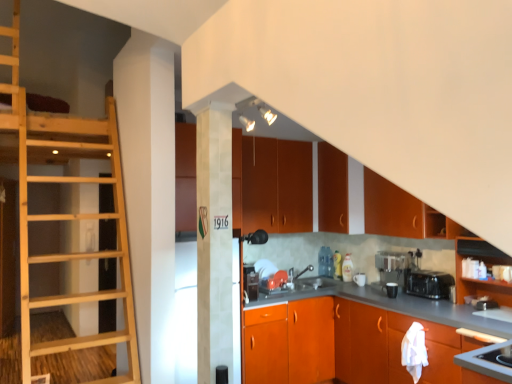
Question: Is matte black coffee maker at lower center, marked as the second appliance in a left-to-right arrangement, inside the boundaries of orange matte cabinet at upper center, the 6th cabinetry positioned from the bottom, or outside?

Choices:
 (A) inside
 (B) outside

Answer: (B)

Question: In terms of width, does matte black coffee maker at lower center, positioned as the first appliance in back-to-front order, look wider or thinner when compared to orange matte cabinet at upper center, the 1th cabinetry when ordered from top to bottom?

Choices:
 (A) thin
 (B) wide

Answer: (A)

Question: Which of these objects is positioned farthest from the matte wood cabinets at center, marked as the fourth cabinetry in a bottom-to-top arrangement?

Choices:
 (A) metallic silver coffee machine at lower right
 (B) matte black coffee maker at lower center, marked as the second appliance in a left-to-right arrangement
 (C) natural wood ladder at left
 (D) orange matte cabinet at right, the second cabinetry from the bottom
 (E) orange matte cabinet at center, the 1th cabinetry ordered from the bottom

Answer: (D)

Question: Estimate the real-world distances between objects in this image. Which object is closer to the matte wood cabinet at upper right, which ranks as the 3th cabinetry in bottom-to-top order?

Choices:
 (A) metallic silver toaster at lower right, which is the 1th appliance in right-to-left order
 (B) metallic silver toaster at center, the 1th appliance when ordered from left to right
 (C) metallic silver coffee machine at lower right
 (D) matte black coffee maker at lower center, marked as the second appliance in a left-to-right arrangement
 (E) matte wood cabinet at upper center, the 5th cabinetry ordered from the bottom

Answer: (E)